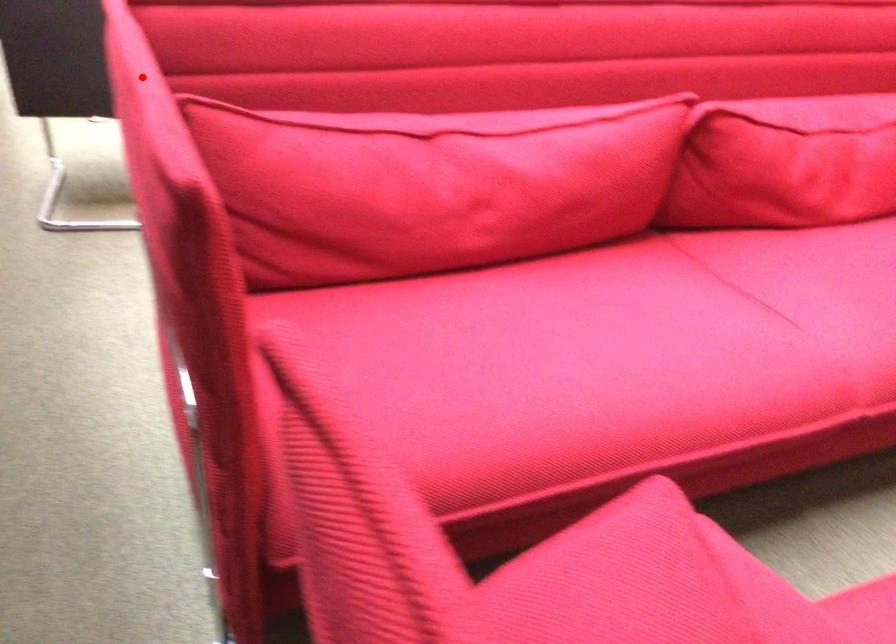
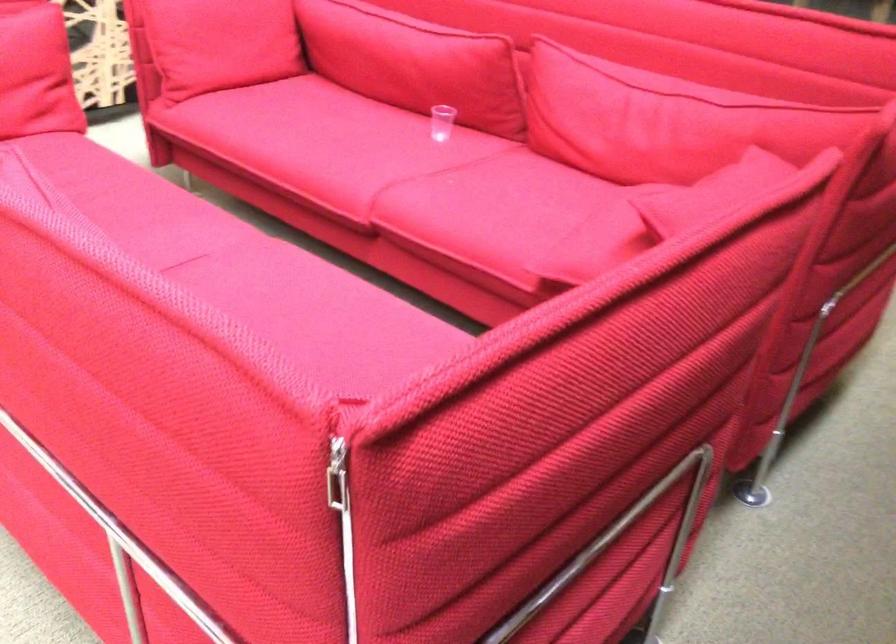
Question: I am providing you with two images of the same scene from different viewpoints. Image1 has a red point marked. In image2, the corresponding 3D location appears at what relative position? Reply with the corresponding letter.

Choices:
 (A) Closer
 (B) Farther

Answer: (A)